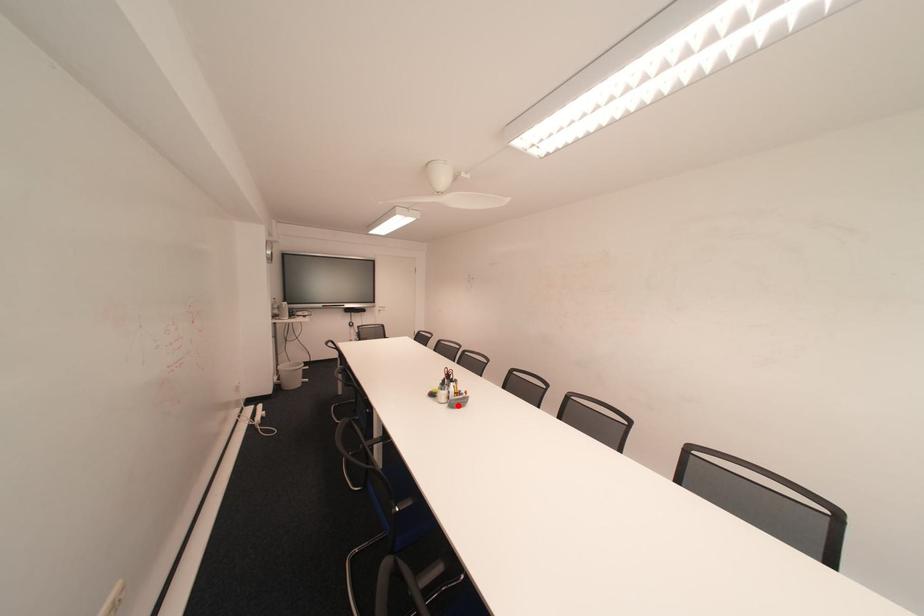
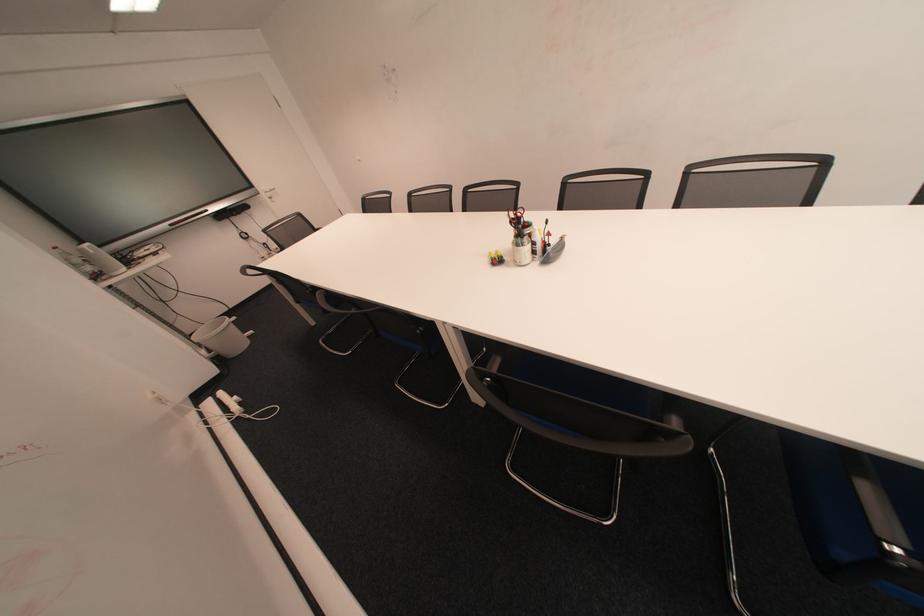
Question: I am providing you with two images of the same scene from different viewpoints. Given a red point in image1, look at the same physical point in image2. Is it:

Choices:
 (A) Closer to the viewpoint
 (B) Farther from the viewpoint

Answer: (A)